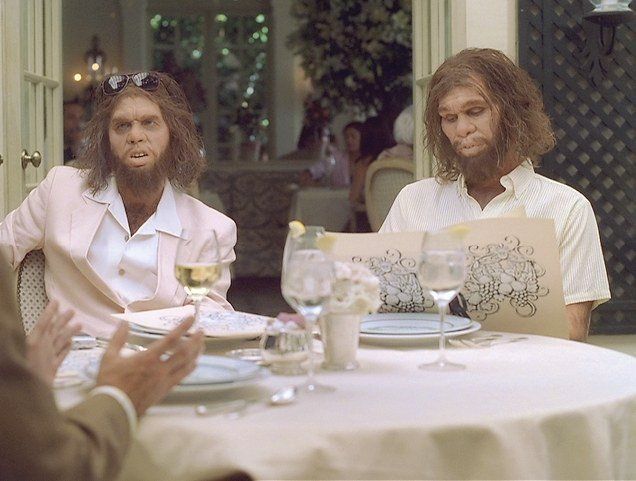
At what (x,y) coordinates should I click in order to perform the action: click on green lights. Please return your answer as a coordinate pair (x, y). Image resolution: width=636 pixels, height=481 pixels. Looking at the image, I should click on (266, 32), (259, 62), (251, 86), (219, 18), (266, 121).